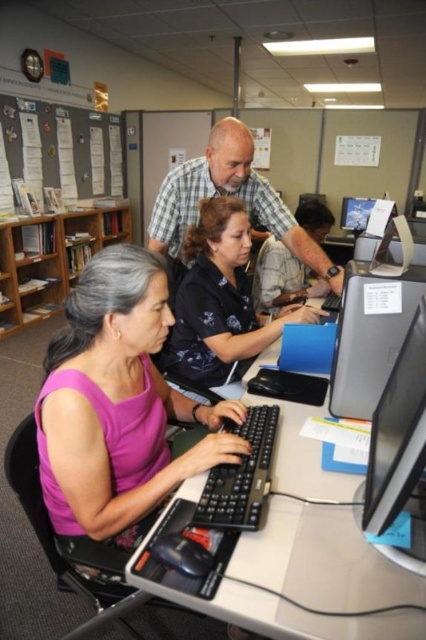
Question: Does black plastic table at lower center appear over satin black monitor at right?

Choices:
 (A) no
 (B) yes

Answer: (A)

Question: Which of the following is the farthest from the observer?

Choices:
 (A) (83, 134)
 (B) (126, 444)
 (C) (23, 253)

Answer: (A)

Question: Does black plastic keyboard at center have a smaller size compared to matte black monitor at center?

Choices:
 (A) yes
 (B) no

Answer: (A)

Question: Can you confirm if black plastic table at lower center is bigger than black matte shirt at center?

Choices:
 (A) yes
 (B) no

Answer: (B)

Question: Which point is farther to the camera?

Choices:
 (A) satin black monitor at right
 (B) black satin blouse at center
 (C) matte black monitor at center

Answer: (C)

Question: Which of these objects is positioned closest to the black plastic table at lower center?

Choices:
 (A) pink matte shirt at center
 (B) black matte shirt at center

Answer: (A)